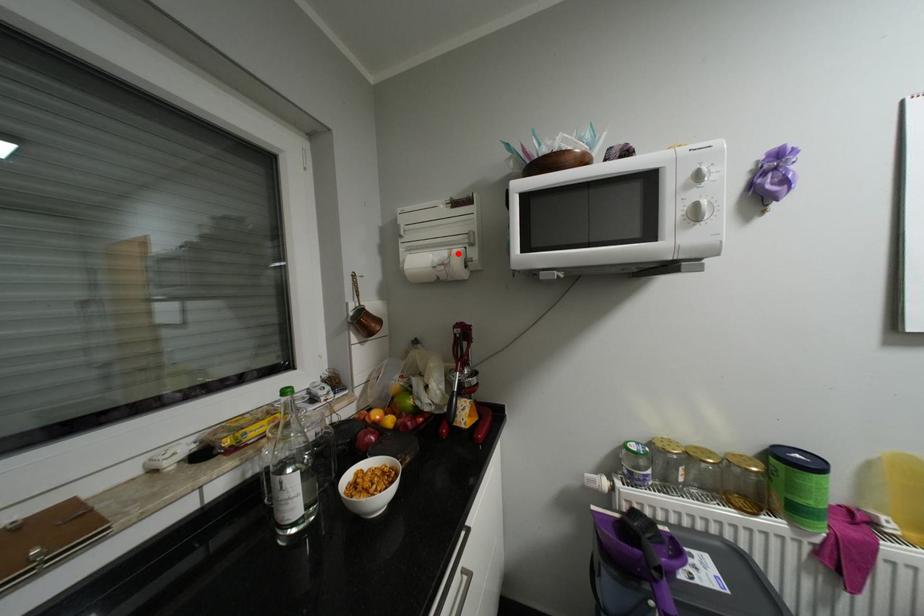
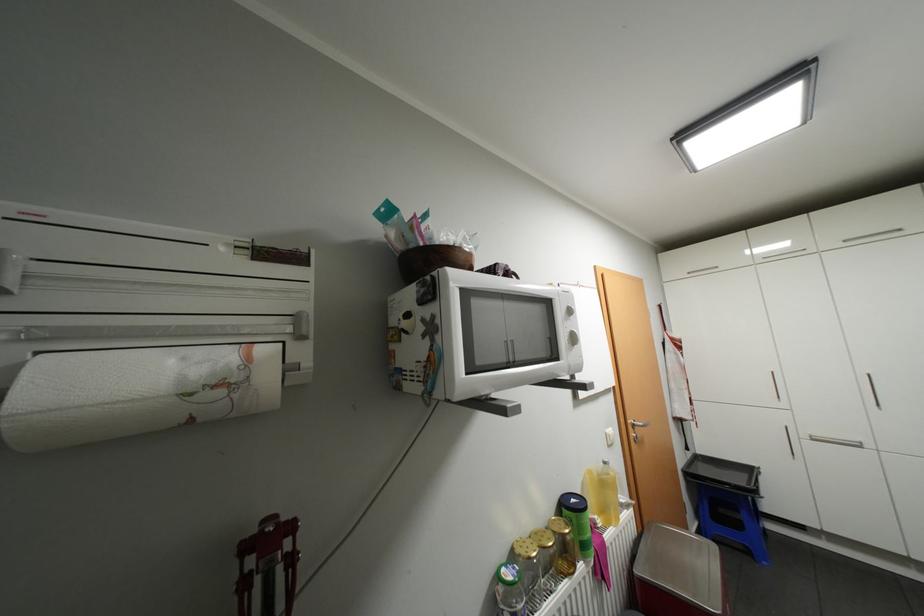
The point at the highlighted location is marked in the first image. Where is the corresponding point in the second image?

(256, 358)